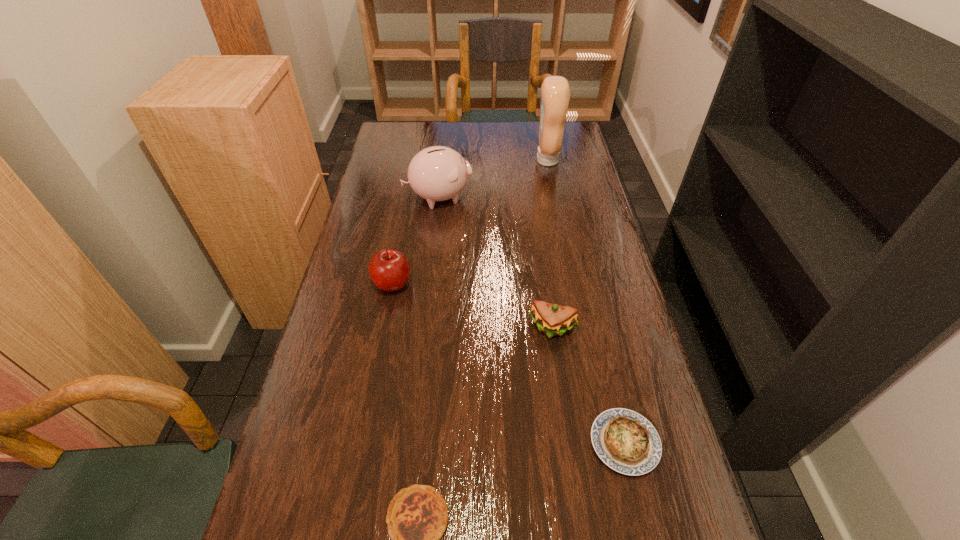
I want to click on the farthest object, so click(x=555, y=92).

Locate an element on the screen. condiment is located at coordinates (555, 92).

Find the location of `the second farthest object`. the second farthest object is located at coordinates (438, 173).

Where is `piggy bank`? The image size is (960, 540). piggy bank is located at coordinates (438, 173).

Where is `the third farthest object`? This screenshot has width=960, height=540. the third farthest object is located at coordinates (389, 270).

The width and height of the screenshot is (960, 540). Find the location of `the fourth shortest object`. the fourth shortest object is located at coordinates [x=389, y=270].

Identify the location of sandwich. (552, 319).

In order to click on the third nearest object in this screenshot , I will do `click(552, 319)`.

Identify the location of the right quiche. The image size is (960, 540). (624, 440).

Image resolution: width=960 pixels, height=540 pixels. I want to click on the farther quiche, so click(624, 440).